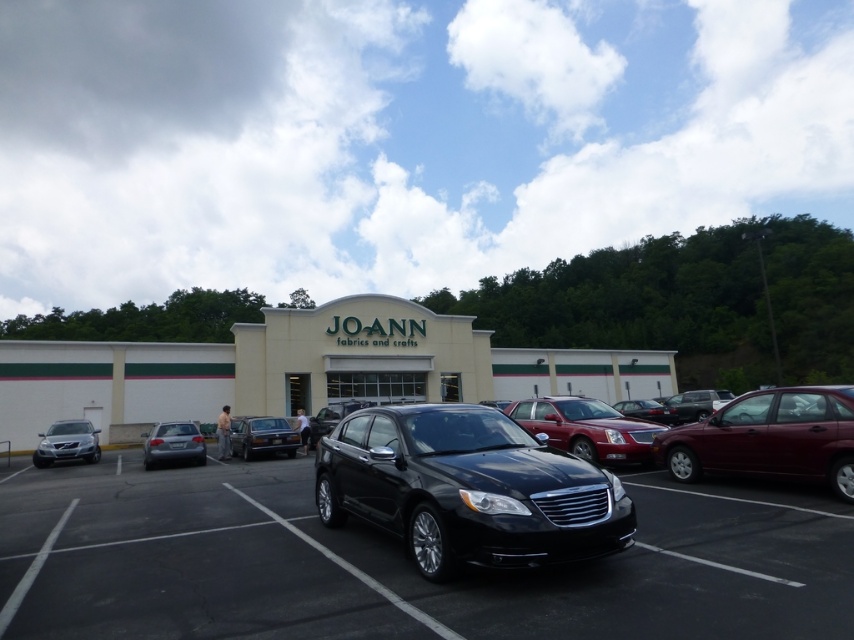
The width and height of the screenshot is (854, 640). Describe the element at coordinates (769, 436) in the screenshot. I see `glossy maroon sedan at right` at that location.

Measure the distance from glossy maroon sedan at right to shiny silver sedan at center.

A distance of 13.86 meters exists between glossy maroon sedan at right and shiny silver sedan at center.

Is point (667, 449) in front of point (254, 440)?

Yes, it is.

Find the location of a particular element. This screenshot has width=854, height=640. glossy maroon sedan at right is located at coordinates (769, 436).

Who is lower down, black glossy sedan at center or satin silver sedan at lower left?

satin silver sedan at lower left is lower down.

Which is more to the right, black glossy sedan at center or satin silver sedan at lower left?

Positioned to the right is black glossy sedan at center.

Is point (361, 488) in front of point (155, 449)?

Yes, it is in front of point (155, 449).

I want to click on black glossy sedan at center, so click(466, 488).

Is shiny red sedan at center below satin silver sedan at left?

Actually, shiny red sedan at center is above satin silver sedan at left.

Between point (522, 413) and point (47, 435), which one is positioned in front?

Point (522, 413) is in front.

Locate an element on the screen. shiny red sedan at center is located at coordinates (588, 428).